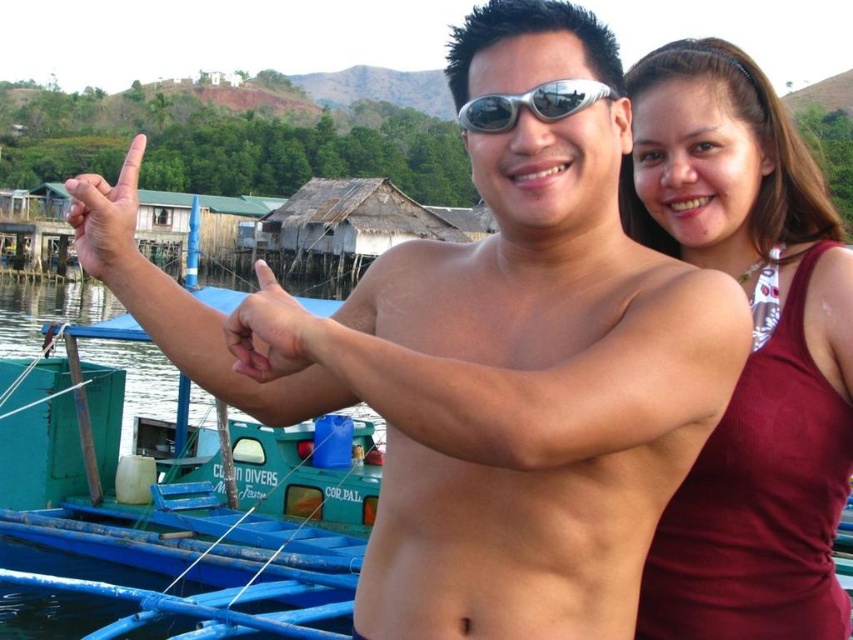
Is green plastic boat at left smaller than matte skin hand at upper left?

Correct, green plastic boat at left occupies less space than matte skin hand at upper left.

Between point (312, 518) and point (125, 173), which one is positioned in front?

Point (125, 173)

Which is in front, point (0, 461) or point (103, 273)?

Positioned in front is point (103, 273).

Image resolution: width=853 pixels, height=640 pixels. What are the coordinates of `green plastic boat at left` in the screenshot? It's located at (178, 492).

Does green plastic boat at left appear over silver metallic goggles at center?

No.

Describe the element at coordinates (178, 492) in the screenshot. This screenshot has width=853, height=640. I see `green plastic boat at left` at that location.

Locate an element on the screen. The image size is (853, 640). green plastic boat at left is located at coordinates (178, 492).

Is matte skin hand at upper left thinner than silver metallic goggles at center?

No, matte skin hand at upper left is not thinner than silver metallic goggles at center.

What do you see at coordinates (108, 220) in the screenshot? The image size is (853, 640). I see `matte skin hand at upper left` at bounding box center [108, 220].

Where is `matte skin hand at upper left`? Image resolution: width=853 pixels, height=640 pixels. matte skin hand at upper left is located at coordinates (108, 220).